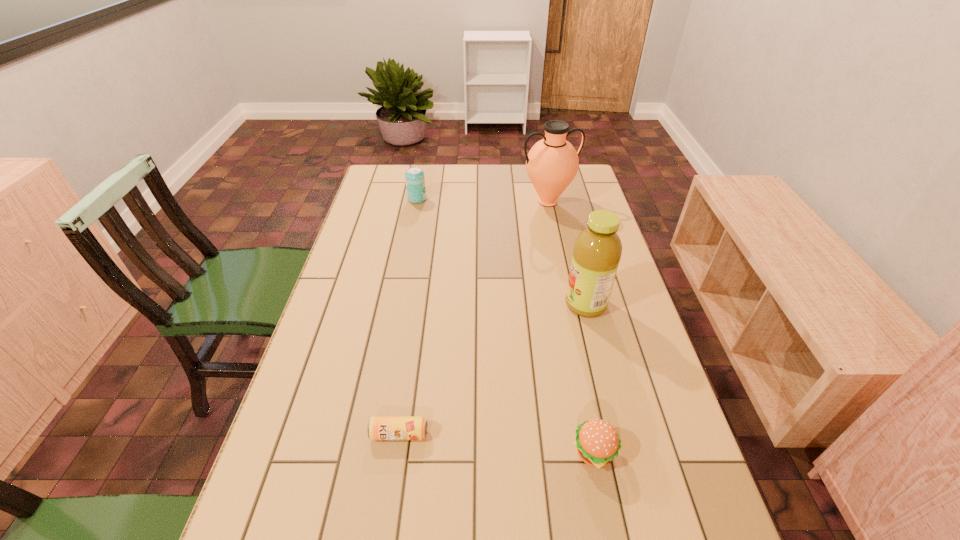
Identify the location of vacant space at the far edge of the desktop. The image size is (960, 540). (497, 171).

Find the location of a particular element. This screenshot has height=540, width=960. free space at the left edge of the desktop is located at coordinates (365, 225).

Where is `vacant space at the right edge of the desktop`? The height and width of the screenshot is (540, 960). vacant space at the right edge of the desktop is located at coordinates (603, 358).

This screenshot has width=960, height=540. In the image, there is a desktop. Find the location of `free region at the far left corner`. free region at the far left corner is located at coordinates (404, 171).

Where is `vacant region between the shortest object and the fourth tallest object`? This screenshot has height=540, width=960. vacant region between the shortest object and the fourth tallest object is located at coordinates (497, 443).

The width and height of the screenshot is (960, 540). What are the coordinates of `empty location between the pitcher and the shortest object` in the screenshot? It's located at (473, 318).

The width and height of the screenshot is (960, 540). In order to click on empty space between the shortest object and the farther beer can in this screenshot , I will do [408, 316].

You are a GUI agent. You are given a task and a screenshot of the screen. Output one action in this format:
    pyautogui.click(x=<x>, y=<y>)
    Task: Click on the empty space that is in between the third nearest object and the farther beer can
    This screenshot has height=540, width=960.
    Given the screenshot: What is the action you would take?
    pyautogui.click(x=501, y=252)

Find the location of a particular element. Image resolution: width=960 pixels, height=540 pixels. vacant space in between the third farthest object and the shortest object is located at coordinates (492, 369).

Find the location of a particular element. Image resolution: width=960 pixels, height=540 pixels. free point between the hamburger and the pitcher is located at coordinates (571, 327).